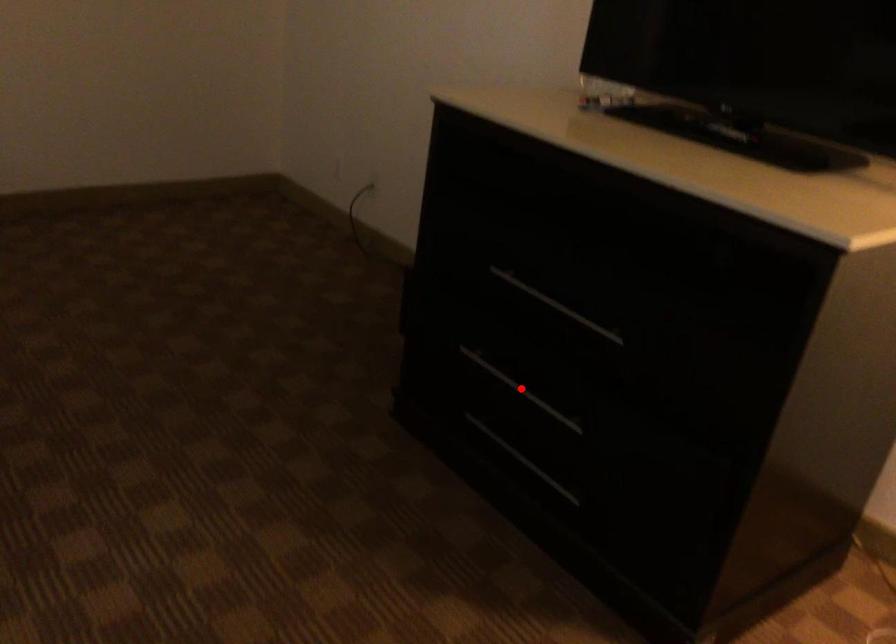
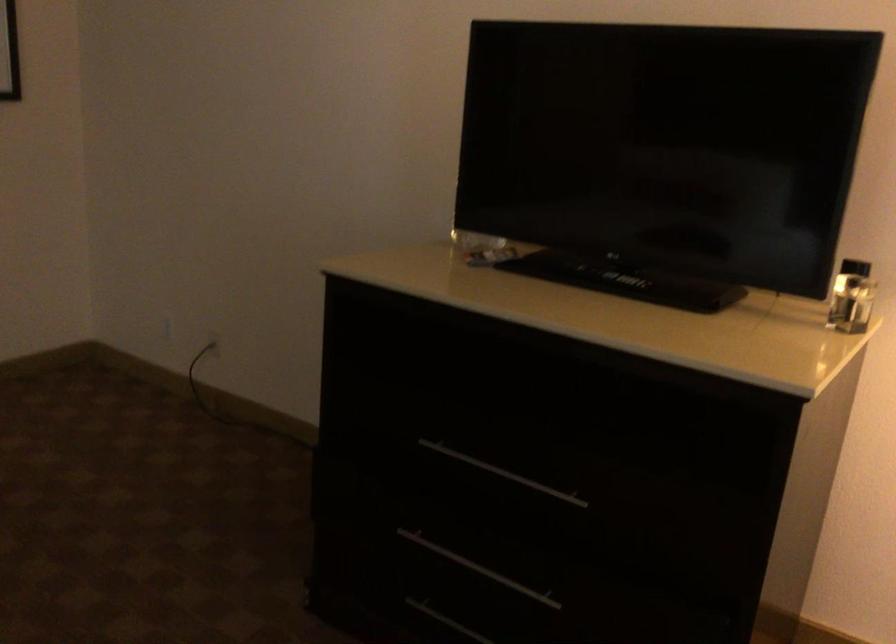
Where in the second image is the point corresponding to the highlighted location from the first image?

(478, 567)